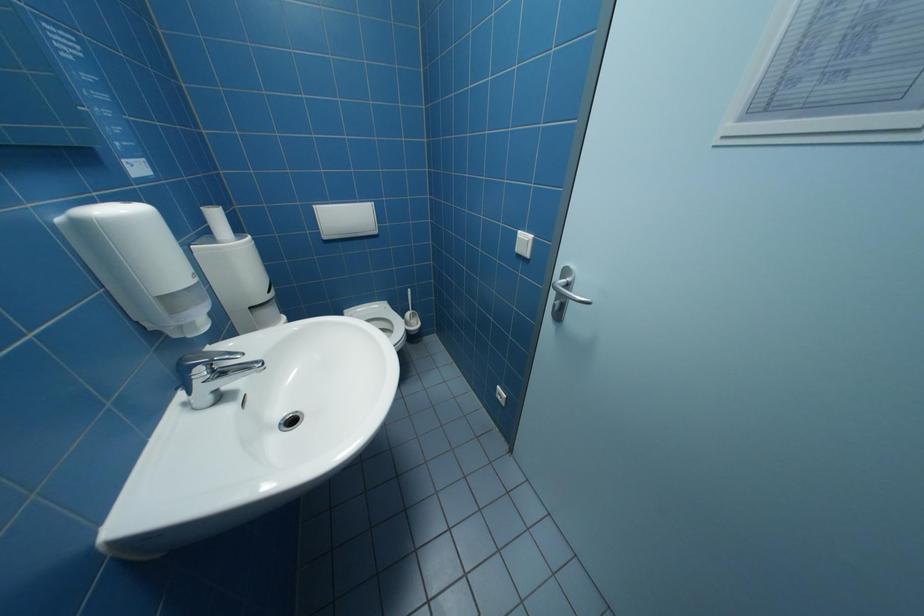
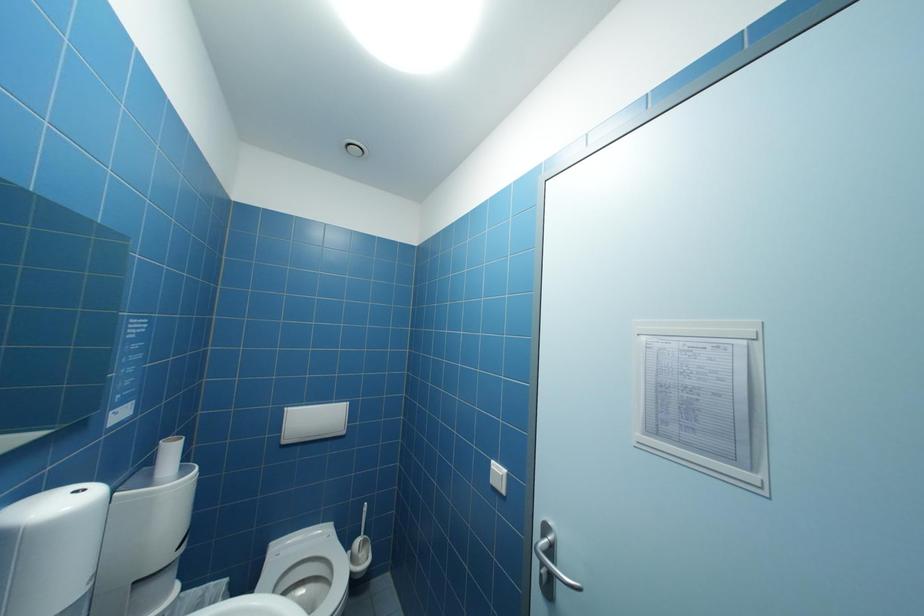
Question: Based on the continuous images, in which direction is the camera rotating? Reply with the corresponding letter.

Choices:
 (A) Left
 (B) Right
 (C) Up
 (D) Down

Answer: (C)